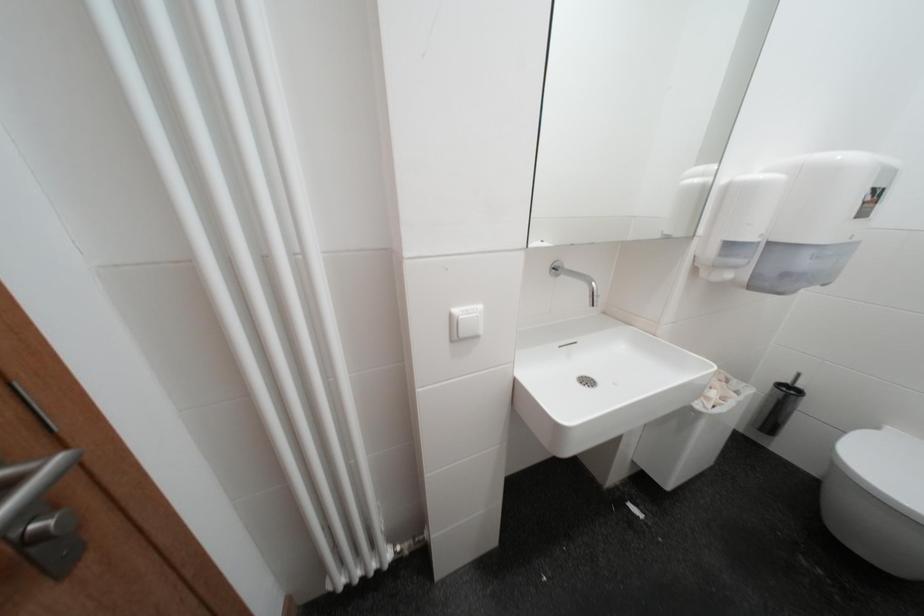
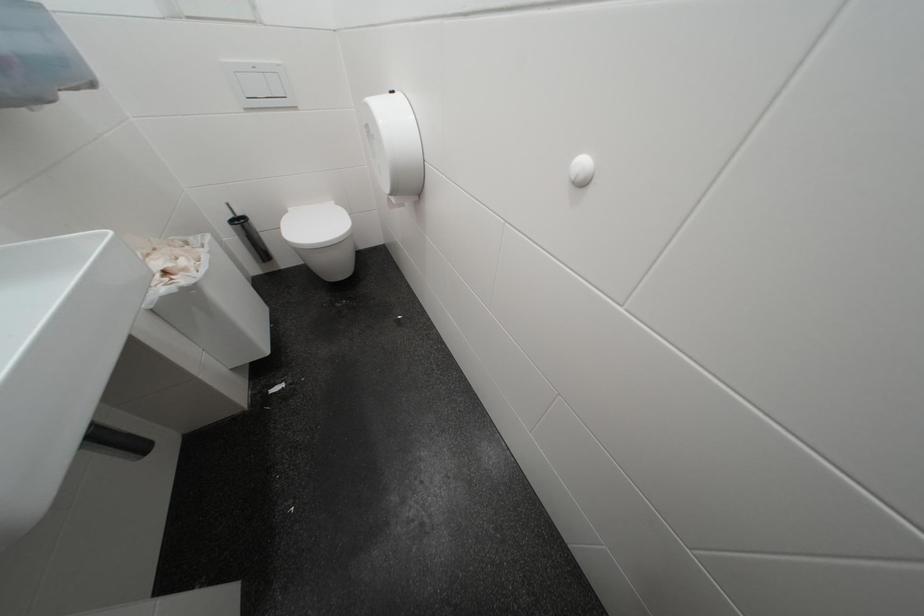
Based on the continuous images, in which direction is the camera rotating?

The rotation direction of the camera is right-down.